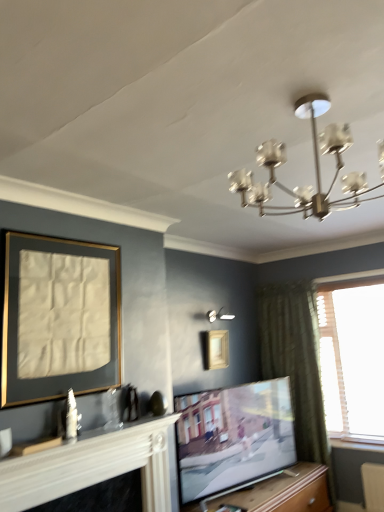
Where is `free space above wooden at center (from a real-world perspective)`? free space above wooden at center (from a real-world perspective) is located at coordinates (263, 487).